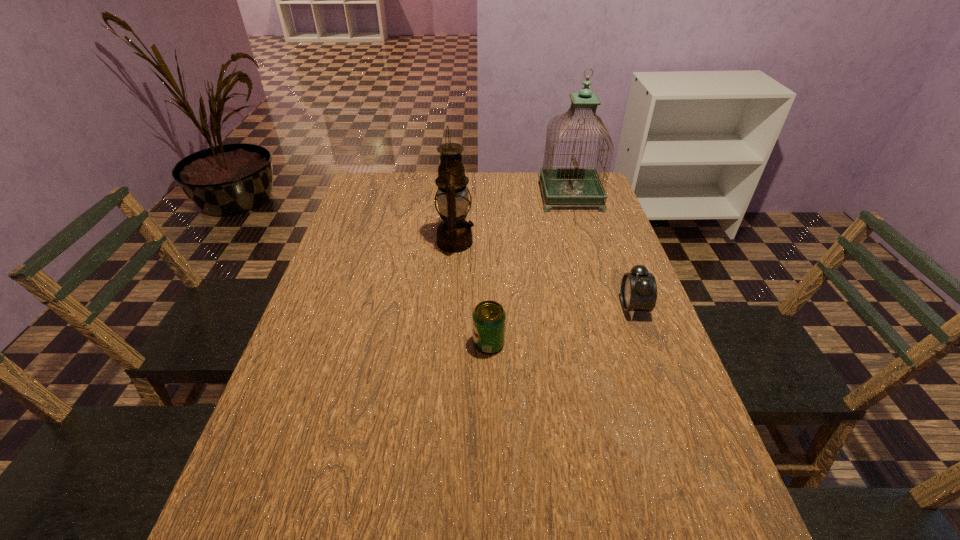
You are a GUI agent. You are given a task and a screenshot of the screen. Output one action in this format:
    pyautogui.click(x=<x>, y=<y>)
    Task: Click on the vacant point located between the third farthest object and the leftmost object
    The width and height of the screenshot is (960, 540).
    Given the screenshot: What is the action you would take?
    pyautogui.click(x=544, y=274)

Image resolution: width=960 pixels, height=540 pixels. Find the location of `empty space between the second object from left to right and the oil lamp`. empty space between the second object from left to right and the oil lamp is located at coordinates (472, 293).

Find the location of a particular element. The image size is (960, 540). free space between the second object from left to right and the farthest object is located at coordinates (530, 270).

Select which object is the closest to the third nearest object. Please provide its 2D coordinates. Your answer should be formatted as a tuple, i.e. [(x, y)], where the tuple contains the x and y coordinates of a point satisfying the conditions above.

[(563, 186)]

In order to click on object that is the nearest to the nearest object in this screenshot , I will do `click(454, 234)`.

The height and width of the screenshot is (540, 960). Find the location of `vacant position in the image that satisfies the following two spatial constraints: 1. at the door of the tallest object; 2. on the front side of the second tallest object`. vacant position in the image that satisfies the following two spatial constraints: 1. at the door of the tallest object; 2. on the front side of the second tallest object is located at coordinates (584, 242).

You are a GUI agent. You are given a task and a screenshot of the screen. Output one action in this format:
    pyautogui.click(x=<x>, y=<y>)
    Task: Click on the vacant point that satisfies the following two spatial constraints: 1. at the door of the tallest object; 2. on the front side of the leftmost object
    This screenshot has height=540, width=960.
    Given the screenshot: What is the action you would take?
    pyautogui.click(x=584, y=242)